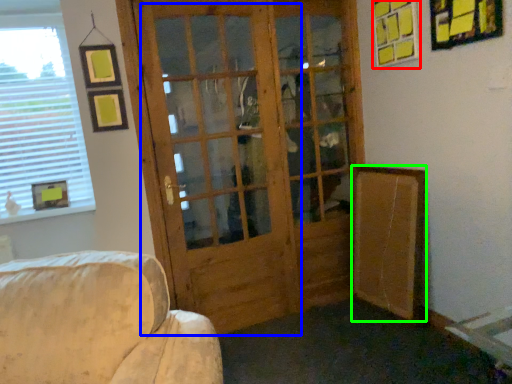
Question: Estimate the real-world distances between objects in this image. Which object is farther from picture frame (highlighted by a red box), screen door (highlighted by a blue box) or bulletin board (highlighted by a green box)?

Choices:
 (A) screen door
 (B) bulletin board

Answer: (A)